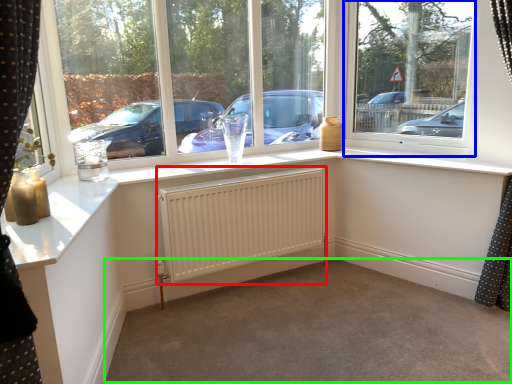
Question: Which is nearer to the radiator (highlighted by a red box)? window screen (highlighted by a blue box) or plain (highlighted by a green box).

Choices:
 (A) window screen
 (B) plain

Answer: (B)